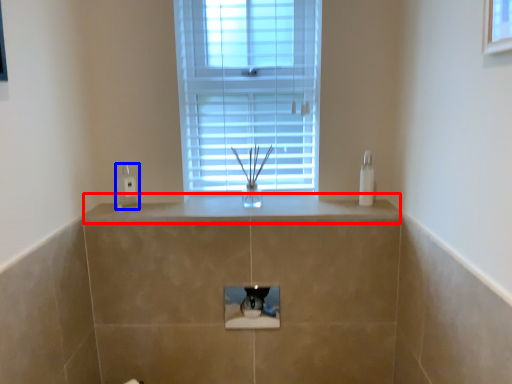
Question: Which point is further to the camera, counter top (highlighted by a red box) or electric outlet (highlighted by a blue box)?

Choices:
 (A) counter top
 (B) electric outlet

Answer: (B)